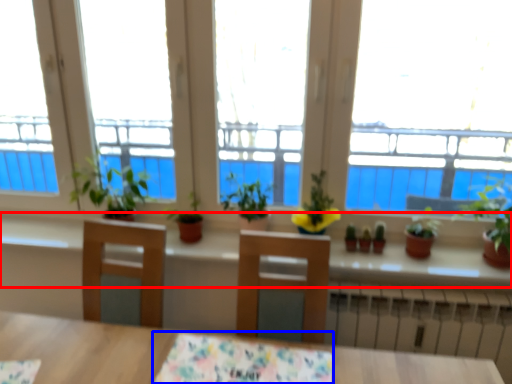
Question: Which of the following is the closest to the observer, window sill (highlighted by a red box) or tablecloth (highlighted by a blue box)?

Choices:
 (A) window sill
 (B) tablecloth

Answer: (B)